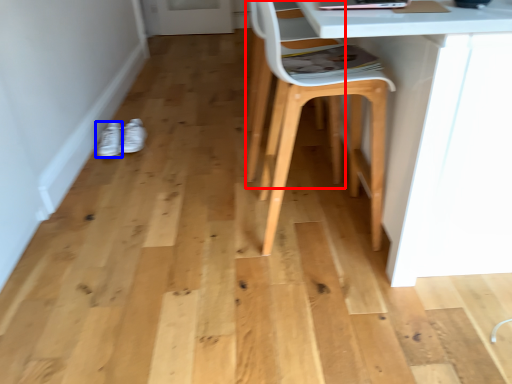
Question: Which point is further to the camera, swivel chair (highlighted by a red box) or footwear (highlighted by a blue box)?

Choices:
 (A) swivel chair
 (B) footwear

Answer: (B)